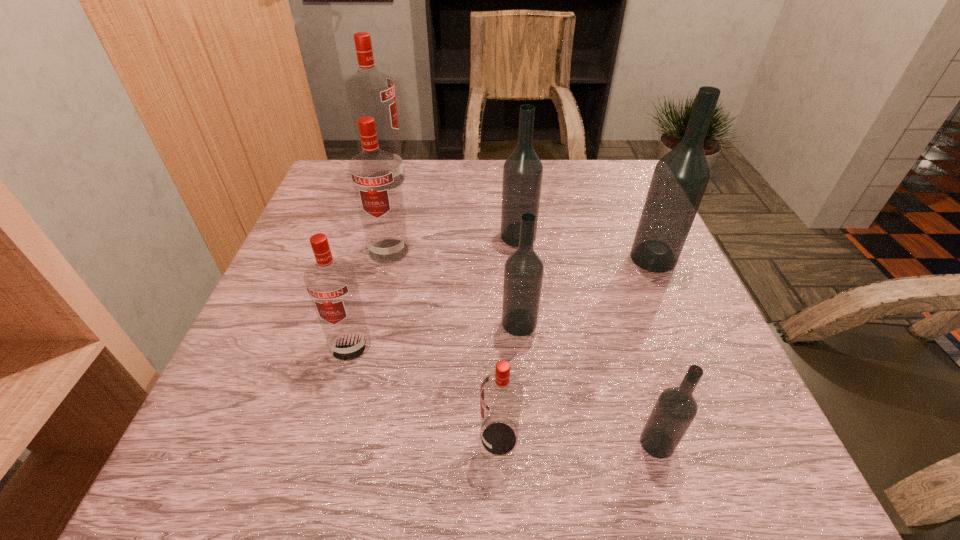
This screenshot has width=960, height=540. Find the location of `the farthest object`. the farthest object is located at coordinates (370, 92).

Locate an element on the screen. the biggest red vodka is located at coordinates (370, 92).

Identify the location of the rightmost vodka. (680, 178).

You are a GUI agent. You are given a task and a screenshot of the screen. Output one action in this format:
    pyautogui.click(x=<x>, y=<y>)
    Task: Click on the rightmost object
    The height and width of the screenshot is (540, 960).
    Given the screenshot: What is the action you would take?
    680,178

You are a GUI agent. You are given a task and a screenshot of the screen. Output one action in this format:
    pyautogui.click(x=<x>, y=<y>)
    Task: Click on the third smallest black vodka
    This screenshot has width=960, height=540.
    Given the screenshot: What is the action you would take?
    pyautogui.click(x=522, y=173)

Where is `the second farthest red vodka`? the second farthest red vodka is located at coordinates (375, 174).

Locate an element on the screen. This screenshot has width=960, height=540. the second smallest black vodka is located at coordinates pos(523,273).

Where is `the second smallest red vodka`? the second smallest red vodka is located at coordinates (331, 283).

You are a GUI agent. You are given a task and a screenshot of the screen. Output one action in this format:
    pyautogui.click(x=<x>, y=<y>)
    Task: Click on the nearest red vodka
    The height and width of the screenshot is (540, 960).
    Given the screenshot: What is the action you would take?
    pyautogui.click(x=501, y=393)

Where is `the smallest red vodka`? The width and height of the screenshot is (960, 540). the smallest red vodka is located at coordinates (501, 393).